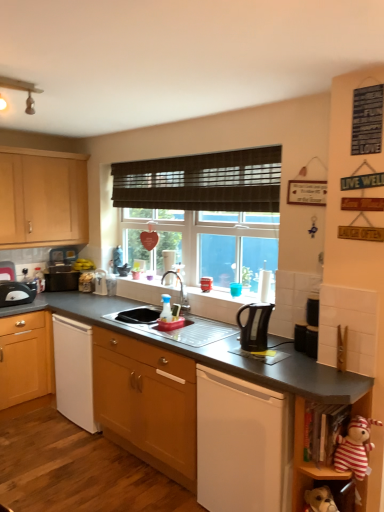
Find the location of a particular element. The height and width of the screenshot is (512, 384). vacant region to the left of black plastic kettle at center, marked as the 1th appliance in a bottom-to-top arrangement is located at coordinates (281, 347).